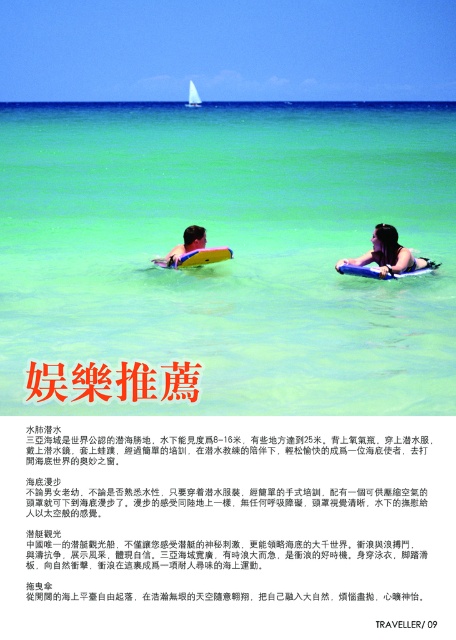
You are a photographer taking a picture of the beach scene. You want to focus on the two points marked in the image. Which point is closer to your camera, point 1 at position (228, 269) or point 2 at position (186, 246)?

Point 2 at position (186, 246) is closer to the camera because it is not as far as point 1 at position (228, 269).

You are standing on the beach and want to take a photo of the transparent blue water at center. Where should you point your camera to capture it?

You should point your camera towards the center of the image at point coordinates approximately 0.391 on the x axis and 0.511 on the y axis to capture the transparent blue water at center.

You are standing on the beach and want to reach a specific point in the water marked at coordinates point (171, 349). If you can swim 1 meter per second, how long will it take you to reach that point?

The distance of point (171, 349) from viewer is 10.81 meters, so it will take approximately 10.81 seconds to reach the point since you swim at 1 meter per second.